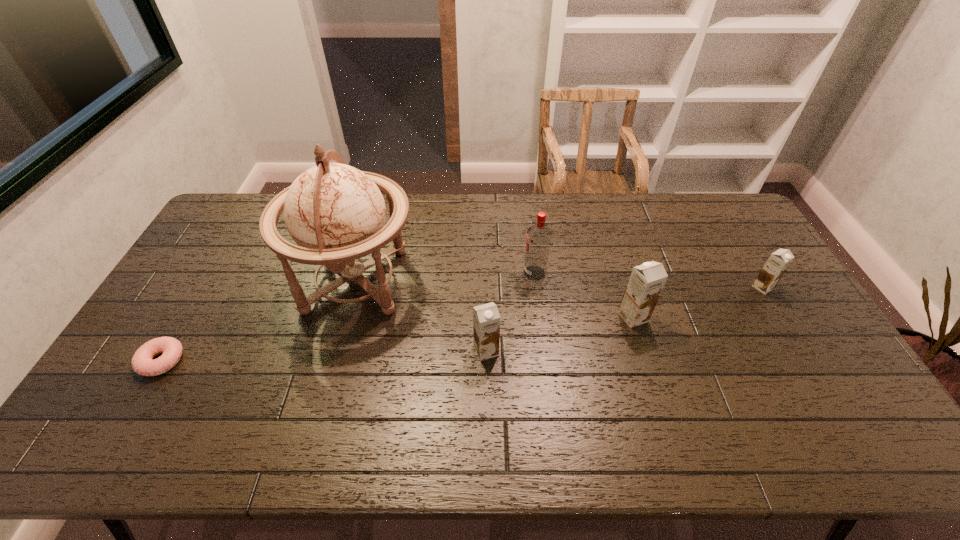
Please point out where to position a new chocolate milk on the left to maintain spacing. Please provide its 2D coordinates. Your answer should be formatted as a tuple, i.e. [(x, y)], where the tuple contains the x and y coordinates of a point satisfying the conditions above.

[(318, 389)]